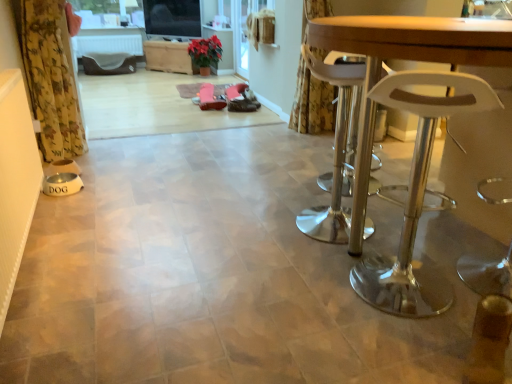
Question: Would you say transparent glass screen door at upper center is part of wooden table at right's contents?

Choices:
 (A) yes
 (B) no

Answer: (B)

Question: Does wooden table at right have a greater width compared to transparent glass screen door at upper center?

Choices:
 (A) yes
 (B) no

Answer: (A)

Question: From the image's perspective, would you say wooden table at right is shown under transparent glass screen door at upper center?

Choices:
 (A) yes
 (B) no

Answer: (A)

Question: Is the depth of wooden table at right greater than that of transparent glass screen door at upper center?

Choices:
 (A) yes
 (B) no

Answer: (B)

Question: Is wooden table at right positioned with its back to transparent glass screen door at upper center?

Choices:
 (A) no
 (B) yes

Answer: (A)

Question: Is floral fabric curtain at upper right, positioned as the first curtain in right-to-left order, bigger or smaller than transparent glass screen door at upper center?

Choices:
 (A) big
 (B) small

Answer: (A)

Question: Is point (307, 97) closer or farther from the camera than point (237, 18)?

Choices:
 (A) farther
 (B) closer

Answer: (B)

Question: From the image's perspective, is floral fabric curtain at upper right, positioned as the first curtain in right-to-left order, located above or below transparent glass screen door at upper center?

Choices:
 (A) below
 (B) above

Answer: (A)

Question: From their relative heights in the image, would you say floral fabric curtain at upper right, positioned as the first curtain in right-to-left order, is taller or shorter than transparent glass screen door at upper center?

Choices:
 (A) short
 (B) tall

Answer: (B)

Question: Is wooden table at right in front of or behind transparent glass screen door at upper center in the image?

Choices:
 (A) front
 (B) behind

Answer: (A)

Question: Do you think wooden table at right is within transparent glass screen door at upper center, or outside of it?

Choices:
 (A) outside
 (B) inside

Answer: (A)

Question: Looking at their shapes, would you say wooden table at right is wider or thinner than transparent glass screen door at upper center?

Choices:
 (A) thin
 (B) wide

Answer: (B)

Question: From a real-world perspective, is wooden table at right above or below transparent glass screen door at upper center?

Choices:
 (A) below
 (B) above

Answer: (A)

Question: Which is correct: wooden table at right is inside yellow floral fabric curtain at left, marked as the first curtain in a left-to-right arrangement, or outside of it?

Choices:
 (A) inside
 (B) outside

Answer: (B)

Question: Is point tap(437, 49) closer or farther from the camera than point tap(55, 67)?

Choices:
 (A) closer
 (B) farther

Answer: (A)